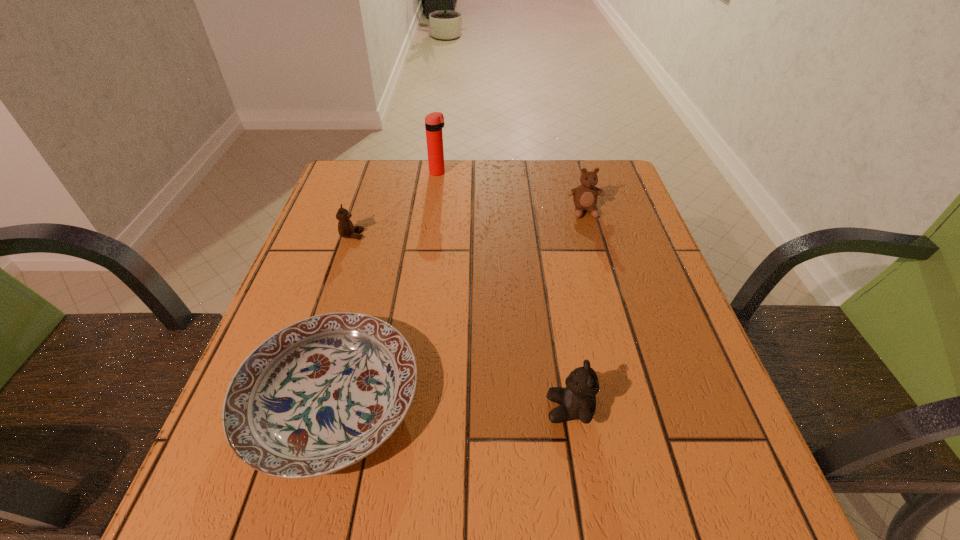
You are a GUI agent. You are given a task and a screenshot of the screen. Output one action in this format:
    pyautogui.click(x=<x>, y=<y>)
    Task: Click on the free space at the far right corner
    This screenshot has width=960, height=540.
    Given the screenshot: What is the action you would take?
    pyautogui.click(x=622, y=187)

The height and width of the screenshot is (540, 960). I want to click on unoccupied area between the farthest teddy bear and the shortest object, so click(458, 306).

The image size is (960, 540). Identify the location of vacant area that lies between the thermos bottle and the rightmost teddy bear. (512, 192).

The image size is (960, 540). Identify the location of vacant region between the second teddy bear from right to left and the second farthest teddy bear. click(461, 322).

This screenshot has width=960, height=540. In order to click on free space between the tallest object and the shortest object in this screenshot , I will do `click(385, 286)`.

Where is `vacant area between the second object from right to left and the farthest teddy bear`? vacant area between the second object from right to left and the farthest teddy bear is located at coordinates (577, 310).

Identify the location of free space that is in between the nearest teddy bear and the leftmost teddy bear. This screenshot has height=540, width=960. (461, 322).

This screenshot has width=960, height=540. What are the coordinates of `free point between the second shortest object and the farthest object` in the screenshot? It's located at pyautogui.click(x=396, y=204).

Where is `vacant space that's between the thermos bottle and the fourth nearest object`? This screenshot has width=960, height=540. vacant space that's between the thermos bottle and the fourth nearest object is located at coordinates (512, 192).

Find the location of a particular element. The image size is (960, 540). vacant space that is in between the second farthest teddy bear and the second teddy bear from right to left is located at coordinates (461, 322).